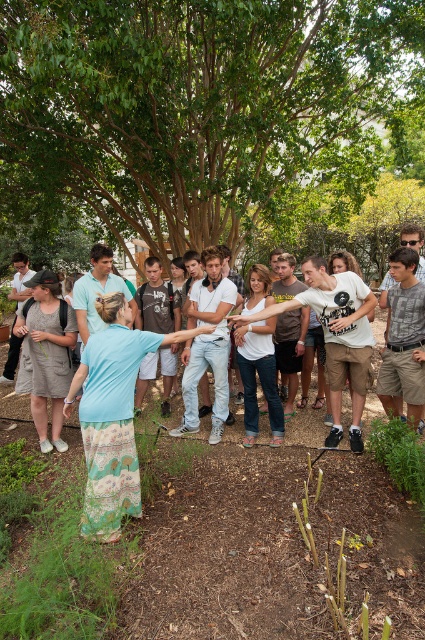
You are organizing a clothing donation drive and need to determine which item takes up more space in the donation box. Based on the scene, which item between the light blue fabric skirt at lower left and the white fabric shirt at center would require more space?

The light blue fabric skirt at lower left is larger in size than the white fabric shirt at center, so it would require more space in the donation box.

You are standing at the edge of the garden and want to walk directly to the green leafy tree at center. However, there is a white fabric shirt at center in your path. Can you walk straight to the tree without going around the shirt?

The green leafy tree at center and white fabric shirt at center are 30.84 feet apart. Since the shirt is in your path, you would need to walk straight towards the tree, passing by the shirt, as they are separated by a distance of 30.84 feet.

You are standing in a garden and see the green leafy tree at center. If you want to take a photo of it with your phone, which has a maximum focus distance of 5 meters, will you be able to capture it clearly?

The green leafy tree at center is 5.11 meters away from the camera. Since the maximum focus distance is 5 meters, the tree is slightly out of range and may not be captured clearly.